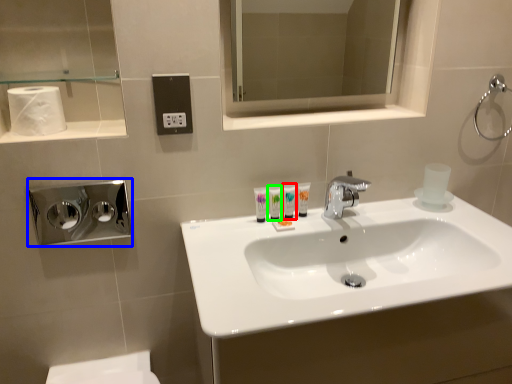
Question: Considering the real-world distances, which object is closest to toiletry (highlighted by a red box)? hand dryer (highlighted by a blue box) or toiletry (highlighted by a green box).

Choices:
 (A) hand dryer
 (B) toiletry

Answer: (B)